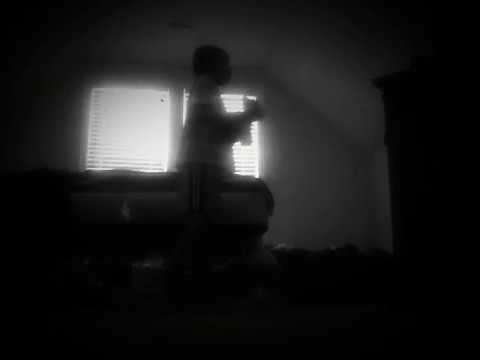
This screenshot has width=480, height=360. Identify the location of blinds. (93, 160), (251, 171).